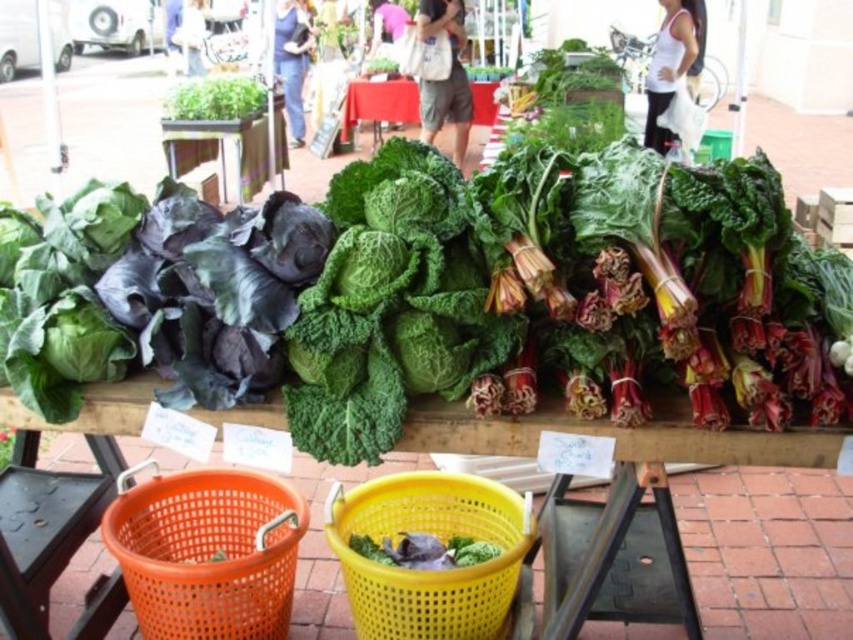
Who is taller, orange plastic basket at lower left or green leafy vegetables at center?

green leafy vegetables at center is taller.

This screenshot has width=853, height=640. Find the location of `orange plastic basket at lower left`. orange plastic basket at lower left is located at coordinates (206, 552).

Find the location of a particular element. The image size is (853, 640). orange plastic basket at lower left is located at coordinates (206, 552).

Does orange plastic basket at lower left have a lesser height compared to green leafy vegetable at center?

In fact, orange plastic basket at lower left may be taller than green leafy vegetable at center.

Between orange plastic basket at lower left and green leafy vegetable at center, which one has more height?

orange plastic basket at lower left

Describe the element at coordinates (206, 552) in the screenshot. I see `orange plastic basket at lower left` at that location.

Where is `orange plastic basket at lower left`? Image resolution: width=853 pixels, height=640 pixels. orange plastic basket at lower left is located at coordinates [x=206, y=552].

Is wooden table at center smaller than green leafy vegetables at center?

Indeed, wooden table at center has a smaller size compared to green leafy vegetables at center.

Who is lower down, wooden table at center or green leafy vegetables at center?

Positioned lower is wooden table at center.

Where is `wooden table at center`? wooden table at center is located at coordinates (514, 428).